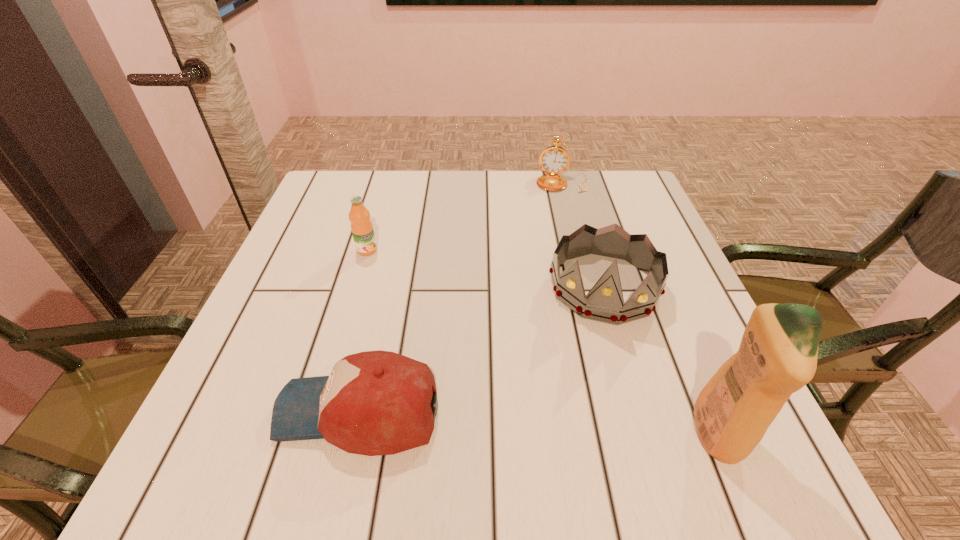
Locate an element on the screen. The height and width of the screenshot is (540, 960). vacant space located at the front of the tiara with jewels is located at coordinates (590, 387).

You are a GUI agent. You are given a task and a screenshot of the screen. Output one action in this format:
    pyautogui.click(x=<x>, y=<y>)
    Task: Click on the blank area located at the front of the tiara with jewels
    
    Given the screenshot: What is the action you would take?
    pyautogui.click(x=588, y=402)

This screenshot has width=960, height=540. I want to click on blank space located on the face of the pocket watch, so click(557, 243).

Locate an element on the screen. The image size is (960, 540). vacant space located 0.300m on the face of the pocket watch is located at coordinates (556, 265).

Locate an element on the screen. This screenshot has width=960, height=540. free region located on the face of the pocket watch is located at coordinates (559, 217).

You are a GUI agent. You are given a task and a screenshot of the screen. Output one action in this format:
    pyautogui.click(x=<x>, y=<y>)
    Task: Click on the object situated at the far edge
    The image size is (960, 540).
    Given the screenshot: What is the action you would take?
    pyautogui.click(x=554, y=160)

This screenshot has height=540, width=960. What are the coordinates of `baseball cap present at the near edge` in the screenshot? It's located at (374, 403).

Locate an element on the screen. Image resolution: width=960 pixels, height=540 pixels. detergent that is positioned at the near edge is located at coordinates 777,356.

This screenshot has width=960, height=540. What are the coordinates of `baseball cap present at the left edge` in the screenshot? It's located at (374, 403).

Locate an element on the screen. orange juice that is at the left edge is located at coordinates (362, 230).